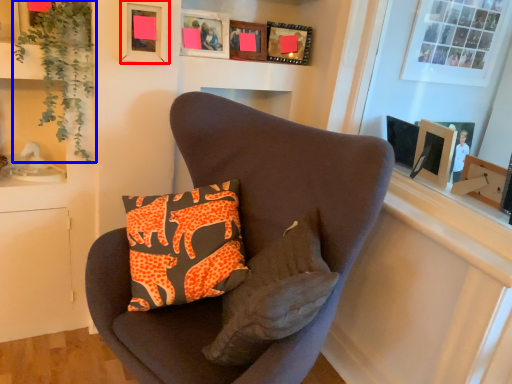
Question: Which object appears farthest to the camera in this image, picture frame (highlighted by a red box) or plant (highlighted by a blue box)?

Choices:
 (A) picture frame
 (B) plant

Answer: (A)